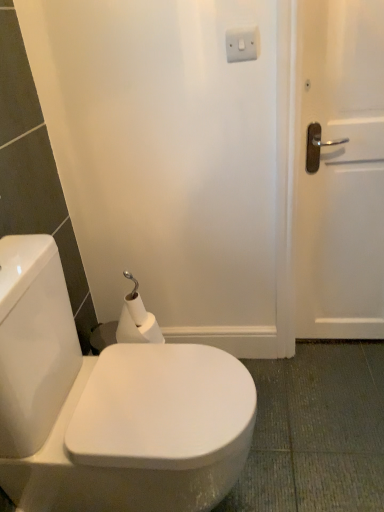
Image resolution: width=384 pixels, height=512 pixels. What do you see at coordinates (109, 406) in the screenshot? I see `white glossy toilet at center` at bounding box center [109, 406].

Locate an element on the screen. white matte toilet paper at lower left is located at coordinates (137, 323).

Describe the element at coordinates (242, 44) in the screenshot. The image size is (384, 512). I see `white plastic switch at upper center` at that location.

Where is `white glossy toilet at center`? This screenshot has width=384, height=512. white glossy toilet at center is located at coordinates (109, 406).

From a real-world perspective, is white glossy toilet at center beneath white plastic switch at upper center?

Yes, from a real-world perspective, white glossy toilet at center is below white plastic switch at upper center.

From the image's perspective, is white glossy toilet at center located above white plastic switch at upper center?

Actually, white glossy toilet at center appears below white plastic switch at upper center in the image.

Does point (107, 486) come in front of point (229, 47)?

Yes.

Does white glossy toilet at center appear on the left side of white plastic switch at upper center?

Correct, you'll find white glossy toilet at center to the left of white plastic switch at upper center.

Would you say white plastic switch at upper center is inside or outside white glossy toilet at center?

white plastic switch at upper center exists outside the volume of white glossy toilet at center.

Who is more distant, white plastic switch at upper center or white glossy toilet at center?

white plastic switch at upper center is more distant.

From the image's perspective, which is above, white plastic switch at upper center or white glossy toilet at center?

white plastic switch at upper center is shown above in the image.

Considering the positions of objects white plastic switch at upper center and white glossy toilet at center in the image provided, who is more to the right, white plastic switch at upper center or white glossy toilet at center?

white plastic switch at upper center is more to the right.

Can you tell me how much white matte toilet paper at lower left and white plastic switch at upper center differ in facing direction?

They differ by 4.08 degrees in their facing directions.

At what (x,y) coordinates should I click in order to perform the action: click on electric outlet above the white matte toilet paper at lower left (from a real-world perspective). Please return your answer as a coordinate pair (x, y). Looking at the image, I should click on (242, 44).

Looking at their sizes, would you say white matte toilet paper at lower left is wider or thinner than white plastic switch at upper center?

white matte toilet paper at lower left is wider than white plastic switch at upper center.

Between white matte toilet paper at lower left and white plastic switch at upper center, which one has less height?

With less height is white plastic switch at upper center.

Looking at this image, is white glossy toilet at center a part of white matte toilet paper at lower left?

No, white glossy toilet at center is not inside white matte toilet paper at lower left.

Is white matte toilet paper at lower left oriented away from white glossy toilet at center?

No, white matte toilet paper at lower left is not facing the opposite direction of white glossy toilet at center.

Which point is more forward, (132, 339) or (226, 390)?

The point (226, 390) is in front.

Is white matte toilet paper at lower left not close to white glossy toilet at center?

Actually, white matte toilet paper at lower left and white glossy toilet at center are a little close together.

Considering the relative sizes of white plastic switch at upper center and white matte toilet paper at lower left in the image provided, is white plastic switch at upper center thinner than white matte toilet paper at lower left?

Indeed, white plastic switch at upper center has a lesser width compared to white matte toilet paper at lower left.

Measure the distance between white plastic switch at upper center and white matte toilet paper at lower left.

A distance of 33.02 inches exists between white plastic switch at upper center and white matte toilet paper at lower left.

Could you tell me if white plastic switch at upper center is facing white matte toilet paper at lower left?

No, white plastic switch at upper center is not aimed at white matte toilet paper at lower left.

From a real-world perspective, is white plastic switch at upper center over white matte toilet paper at lower left?

Yes, from a real-world perspective, white plastic switch at upper center is on top of white matte toilet paper at lower left.

In terms of size, does white glossy toilet at center appear bigger or smaller than white matte toilet paper at lower left?

Considering their sizes, white glossy toilet at center takes up more space than white matte toilet paper at lower left.

Considering the relative sizes of white glossy toilet at center and white matte toilet paper at lower left in the image provided, is white glossy toilet at center taller than white matte toilet paper at lower left?

Yes, white glossy toilet at center is taller than white matte toilet paper at lower left.

Does white glossy toilet at center come behind white matte toilet paper at lower left?

Result: No, it is not.

Find the location of a particular element. The image size is (384, 512). toilet below the white plastic switch at upper center (from the image's perspective) is located at coordinates (109, 406).

This screenshot has height=512, width=384. In order to click on electric outlet above the white glossy toilet at center (from the image's perspective) in this screenshot , I will do `click(242, 44)`.

Looking at this image, which object lies nearer to the anchor point white plastic switch at upper center, white glossy toilet at center or white matte toilet paper at lower left?

white matte toilet paper at lower left is positioned closer to the anchor white plastic switch at upper center.

Based on the photo, estimate the real-world distances between objects in this image. Which object is closer to white glossy toilet at center, white matte toilet paper at lower left or white plastic switch at upper center?

Among the two, white matte toilet paper at lower left is located nearer to white glossy toilet at center.

Considering their positions, is white plastic switch at upper center positioned closer to white glossy toilet at center than white matte toilet paper at lower left?

The object closer to white glossy toilet at center is white matte toilet paper at lower left.

Looking at the image, which one is located further to white matte toilet paper at lower left, white glossy toilet at center or white plastic switch at upper center?

white plastic switch at upper center is further to white matte toilet paper at lower left.

Based on their spatial positions, is white matte toilet paper at lower left or white glossy toilet at center closer to white plastic switch at upper center?

white matte toilet paper at lower left.

Estimate the real-world distances between objects in this image. Which object is further from white matte toilet paper at lower left, white plastic switch at upper center or white glossy toilet at center?

white plastic switch at upper center.

Find the location of a particular element. This screenshot has height=512, width=384. toilet paper between white plastic switch at upper center and white glossy toilet at center in the up-down direction is located at coordinates (137, 323).